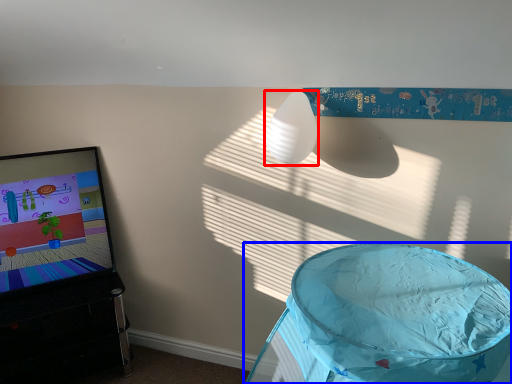
Question: Which point is further to the camera, lamp (highlighted by a red box) or furniture (highlighted by a blue box)?

Choices:
 (A) lamp
 (B) furniture

Answer: (A)